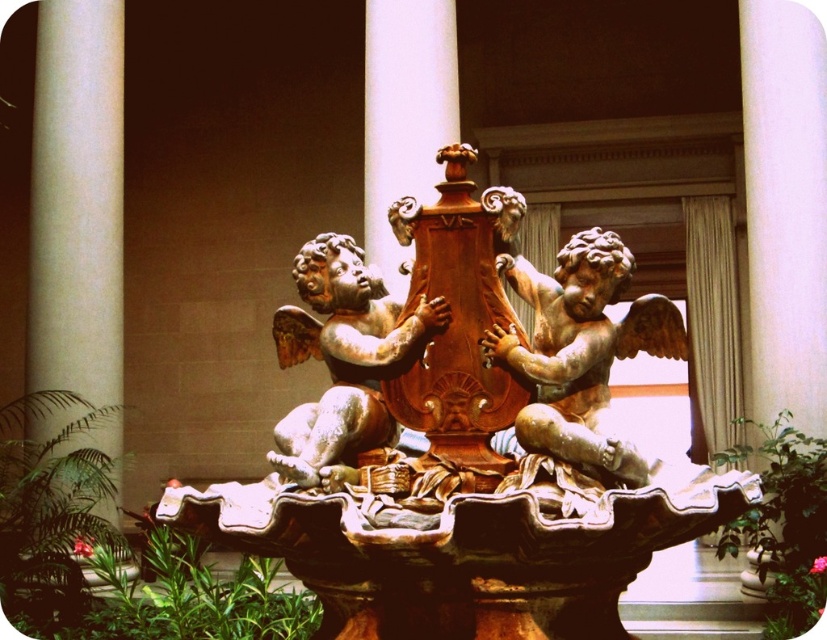
Question: Which of these objects is positioned closest to the white smooth pillar at left?

Choices:
 (A) matte bronze cherub fountain at center
 (B) golden polished cherub at center

Answer: (B)

Question: Which of the following is the closest to the observer?

Choices:
 (A) (586, 534)
 (B) (73, 12)
 (C) (373, 422)

Answer: (A)

Question: Is matte bronze cherub fountain at center in front of golden polished cherub at center?

Choices:
 (A) no
 (B) yes

Answer: (B)

Question: Does matte bronze cherub fountain at center come in front of white smooth pillar at left?

Choices:
 (A) no
 (B) yes

Answer: (B)

Question: Is matte bronze cherub fountain at center positioned behind golden polished cherub at center?

Choices:
 (A) no
 (B) yes

Answer: (A)

Question: Estimate the real-world distances between objects in this image. Which object is closer to the brown polished wood at center?

Choices:
 (A) matte bronze cherub fountain at center
 (B) golden polished cherub at center
 (C) white smooth pillar at left

Answer: (A)